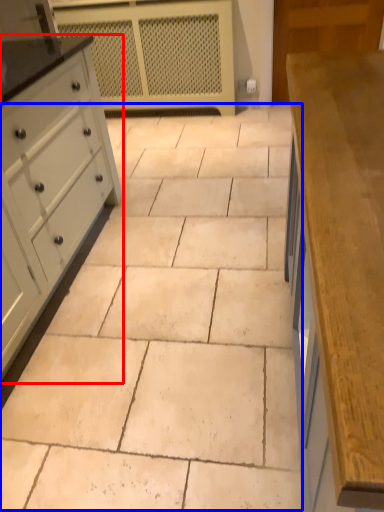
Question: Which of the following is the closest to the observer, chest of drawers (highlighted by a red box) or ceramic tile (highlighted by a blue box)?

Choices:
 (A) chest of drawers
 (B) ceramic tile

Answer: (B)